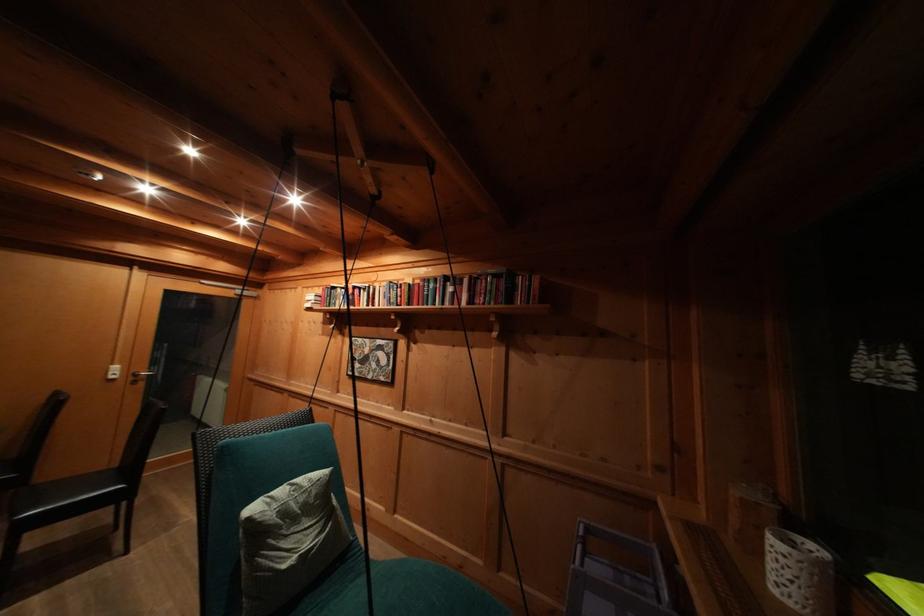
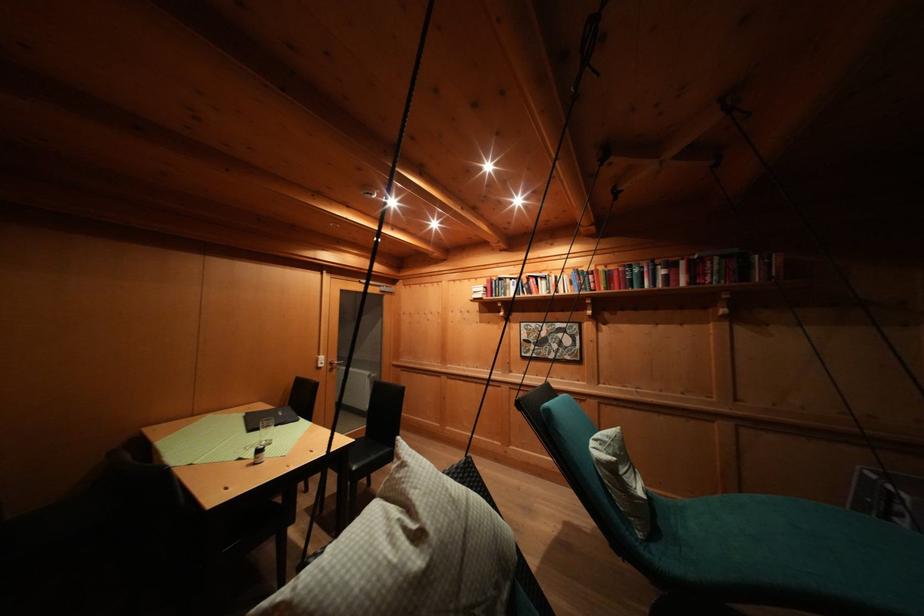
Where in the second image is the point corresponding to point (345, 294) from the first image?

(514, 285)